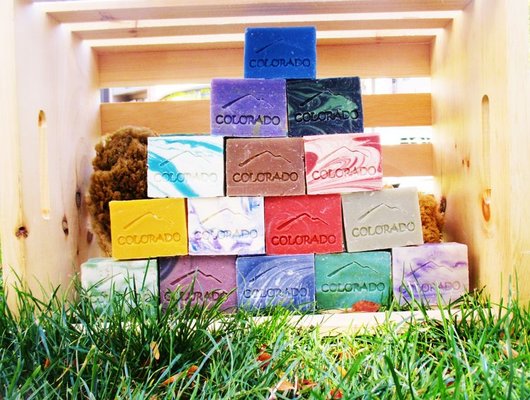
What are the coordinates of `decorative soap` in the screenshot? It's located at (270, 109).